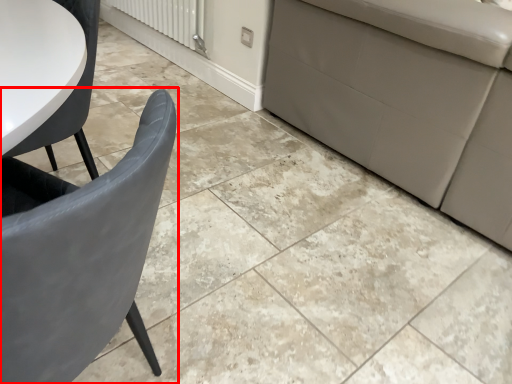
Question: From the image's perspective, what is the correct spatial relationship of chair (annotated by the red box) in relation to radiator?

Choices:
 (A) below
 (B) above

Answer: (A)